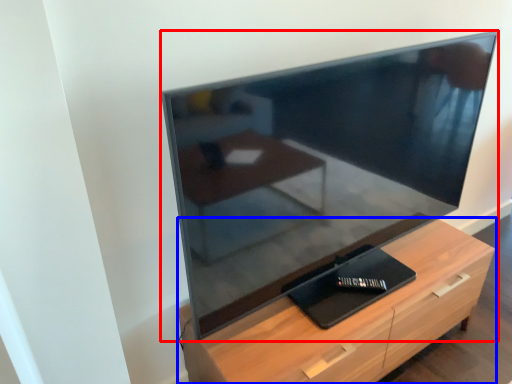
Question: Among these objects, which one is farthest to the camera, television (highlighted by a red box) or chest of drawers (highlighted by a blue box)?

Choices:
 (A) television
 (B) chest of drawers

Answer: (B)